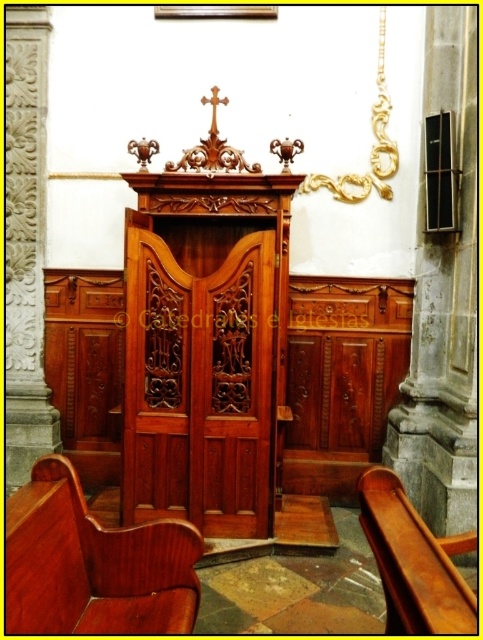
You are a visitor entering the church and see the polished wood door at center and the mahogany wood bench at lower left. Which object is located to the right of the other?

The polished wood door at center is positioned on the right side of mahogany wood bench at lower left, so the polished wood door at center is to the right of the mahogany wood bench at lower left.

You are a visitor entering the church and want to sit down. You see the polished wood door at center and the mahogany wood bench at lower left. Which object should you approach if you want to sit?

The mahogany wood bench at lower left is the object you should approach to sit since it is a bench, while the polished wood door at center is a door and cannot be sat on.

You are standing in a church and want to approach the confessional booth. The confessional booth is located at point (208,368). If you walk straight towards it, how far will you have to walk?

The distance between point (208,368) and the viewer is 3.47 meters, so you will have to walk 3.47 meters to reach the confessional booth.